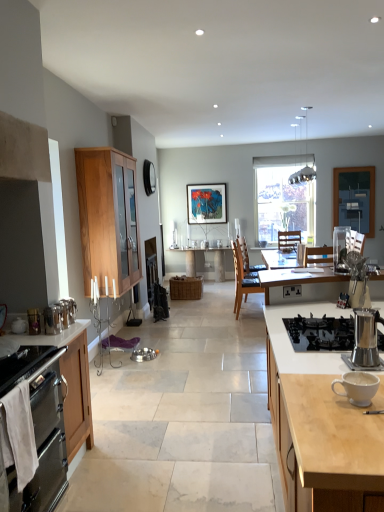
Question: Does matte wooden picture frame at center contain metallic silver kettle at left, placed as the fifth appliance when sorted from top to bottom?

Choices:
 (A) yes
 (B) no

Answer: (B)

Question: From a real-world perspective, is matte wooden picture frame at center physically above metallic silver kettle at left, which ranks as the 2th appliance in bottom-to-top order?

Choices:
 (A) no
 (B) yes

Answer: (B)

Question: Is matte wooden picture frame at center outside metallic silver kettle at left, which is counted as the third appliance, starting from the front?

Choices:
 (A) no
 (B) yes

Answer: (B)

Question: Considering the relative sizes of matte wooden picture frame at center and metallic silver kettle at left, which is counted as the third appliance, starting from the front, in the image provided, is matte wooden picture frame at center wider than metallic silver kettle at left, which is counted as the third appliance, starting from the front,?

Choices:
 (A) no
 (B) yes

Answer: (A)

Question: Does matte wooden picture frame at center have a greater height compared to metallic silver kettle at left, the 1th appliance viewed from the left?

Choices:
 (A) no
 (B) yes

Answer: (B)

Question: Would you say metallic silver kettle at left, which is counted as the third appliance, starting from the front, is inside or outside wooden table at center?

Choices:
 (A) outside
 (B) inside

Answer: (A)

Question: From the image's perspective, is metallic silver kettle at left, which appears as the sixth appliance when viewed from the right, above or below wooden table at center?

Choices:
 (A) above
 (B) below

Answer: (B)

Question: In terms of height, does metallic silver kettle at left, placed as the fifth appliance when sorted from top to bottom, look taller or shorter compared to wooden table at center?

Choices:
 (A) tall
 (B) short

Answer: (B)

Question: Visually, is metallic silver kettle at left, which appears as the sixth appliance when viewed from the right, positioned to the left or to the right of wooden table at center?

Choices:
 (A) left
 (B) right

Answer: (A)

Question: Is point (34, 435) positioned closer to the camera than point (145, 350)?

Choices:
 (A) closer
 (B) farther

Answer: (A)

Question: Is stainless steel oven at lower left wider or thinner than silver metallic bowls at center, which is the 6th appliance in front-to-back order?

Choices:
 (A) thin
 (B) wide

Answer: (B)

Question: From their relative heights in the image, would you say stainless steel oven at lower left is taller or shorter than silver metallic bowls at center, the first appliance positioned from the bottom?

Choices:
 (A) tall
 (B) short

Answer: (A)

Question: Considering their positions, is stainless steel oven at lower left located in front of or behind silver metallic bowls at center, the 6th appliance in the top-to-bottom sequence?

Choices:
 (A) behind
 (B) front

Answer: (B)

Question: From the image's perspective, is clear glass window at center located above or below metallic silver kettle at left, the 1th appliance viewed from the left?

Choices:
 (A) below
 (B) above

Answer: (B)

Question: From a real-world perspective, relative to metallic silver kettle at left, which ranks as the 2th appliance in bottom-to-top order, is clear glass window at center vertically above or below?

Choices:
 (A) above
 (B) below

Answer: (A)